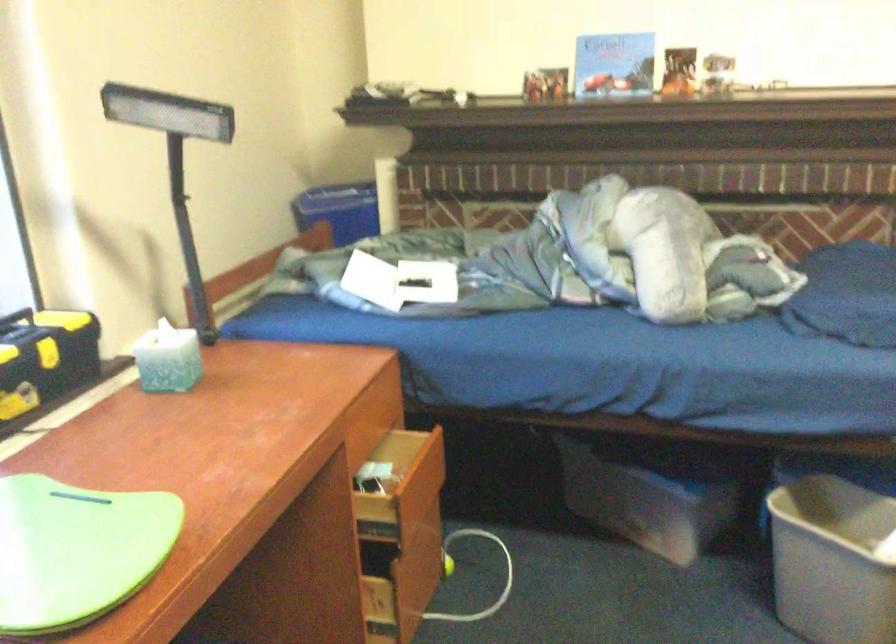
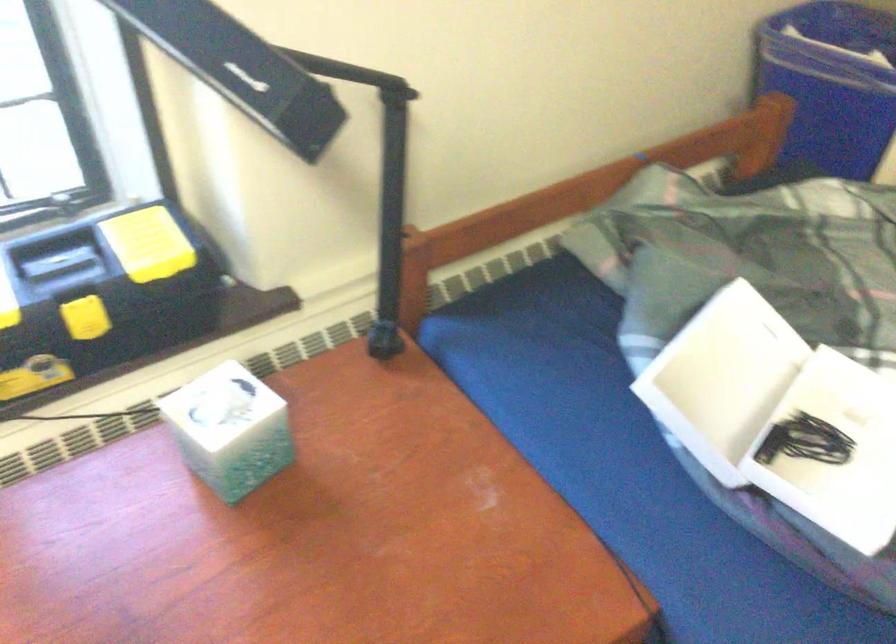
Locate, in the second image, the point that corresponds to the point at 167,345 in the first image.

(229, 430)